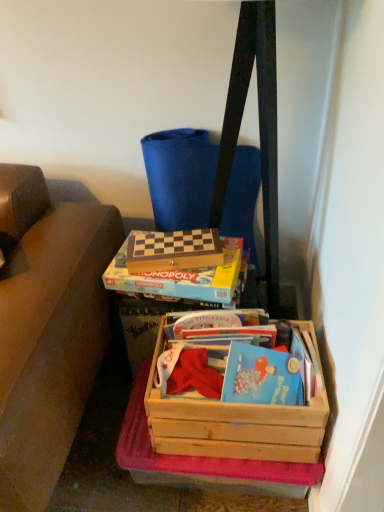
Locate an element on the screen. Image resolution: width=384 pixels, height=512 pixels. vacant space in front of wooden chessboard at center, which is the first box from top to bottom is located at coordinates (177, 277).